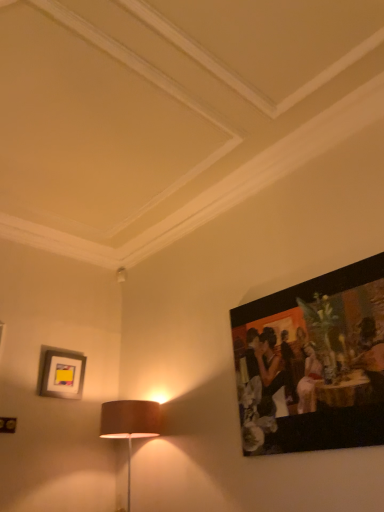
The height and width of the screenshot is (512, 384). What do you see at coordinates (61, 374) in the screenshot? I see `matte yellow picture frame at upper left, which is the first picture frame from back to front` at bounding box center [61, 374].

You are a GUI agent. You are given a task and a screenshot of the screen. Output one action in this format:
    pyautogui.click(x=<x>, y=<y>)
    Task: Click on the matte yellow picture frame at upper left, which is the first picture frame from back to front
    The width and height of the screenshot is (384, 512).
    Given the screenshot: What is the action you would take?
    pyautogui.click(x=61, y=374)

I want to click on matte black painting at upper right, which ranks as the 1th picture frame in front-to-back order, so click(x=313, y=362).

Describe the element at coordinates (313, 362) in the screenshot. Image resolution: width=384 pixels, height=512 pixels. I see `matte black painting at upper right, the second picture frame when ordered from left to right` at that location.

Looking at this image, how much space does matte black painting at upper right, the second picture frame when ordered from left to right, occupy vertically?

The height of matte black painting at upper right, the second picture frame when ordered from left to right, is 35.16 inches.

The image size is (384, 512). What are the coordinates of `matte yellow picture frame at upper left, marked as the 1th picture frame in a left-to-right arrangement` in the screenshot? It's located at (61, 374).

Is matte yellow picture frame at upper left, which is the first picture frame from back to front, at the left side of matte black painting at upper right, positioned as the 2th picture frame in back-to-front order?

Correct, you'll find matte yellow picture frame at upper left, which is the first picture frame from back to front, to the left of matte black painting at upper right, positioned as the 2th picture frame in back-to-front order.

Considering their positions, is matte yellow picture frame at upper left, which is the first picture frame from back to front, located in front of or behind matte black painting at upper right, which ranks as the 1th picture frame in front-to-back order?

In the image, matte yellow picture frame at upper left, which is the first picture frame from back to front, appears behind matte black painting at upper right, which ranks as the 1th picture frame in front-to-back order.

Is point (70, 362) farther from viewer compared to point (372, 329)?

Yes, it is behind point (372, 329).

From the image's perspective, is matte yellow picture frame at upper left, positioned as the 2th picture frame in right-to-left order, under matte black painting at upper right, the 1th picture frame positioned from the right?

Yes, from the image's perspective, matte yellow picture frame at upper left, positioned as the 2th picture frame in right-to-left order, is below matte black painting at upper right, the 1th picture frame positioned from the right.

From a real-world perspective, which is physically below, matte yellow picture frame at upper left, positioned as the 2th picture frame in right-to-left order, or matte black painting at upper right, which ranks as the 1th picture frame in front-to-back order?

matte black painting at upper right, which ranks as the 1th picture frame in front-to-back order, from a real-world perspective.

Consider the image. Which of these two, matte yellow picture frame at upper left, placed as the second picture frame when sorted from front to back, or matte black painting at upper right, positioned as the 2th picture frame in back-to-front order, is wider?

matte yellow picture frame at upper left, placed as the second picture frame when sorted from front to back.

Who is shorter, matte yellow picture frame at upper left, marked as the 1th picture frame in a left-to-right arrangement, or matte black painting at upper right, which ranks as the 1th picture frame in front-to-back order?

matte yellow picture frame at upper left, marked as the 1th picture frame in a left-to-right arrangement, is shorter.

Considering the sizes of matte yellow picture frame at upper left, which is the first picture frame from back to front, and matte black painting at upper right, the second picture frame when ordered from left to right, in the image, is matte yellow picture frame at upper left, which is the first picture frame from back to front, bigger or smaller than matte black painting at upper right, the second picture frame when ordered from left to right,?

Considering their sizes, matte yellow picture frame at upper left, which is the first picture frame from back to front, takes up less space than matte black painting at upper right, the second picture frame when ordered from left to right.

Does matte yellow picture frame at upper left, positioned as the 2th picture frame in right-to-left order, contain matte black painting at upper right, which ranks as the 1th picture frame in front-to-back order?

No.

Are matte yellow picture frame at upper left, positioned as the 2th picture frame in right-to-left order, and matte black painting at upper right, positioned as the 2th picture frame in back-to-front order, making contact?

No, matte yellow picture frame at upper left, positioned as the 2th picture frame in right-to-left order, is not in contact with matte black painting at upper right, positioned as the 2th picture frame in back-to-front order.

Is matte yellow picture frame at upper left, positioned as the 2th picture frame in right-to-left order, turned away from matte black painting at upper right, positioned as the 2th picture frame in back-to-front order?

No, matte black painting at upper right, positioned as the 2th picture frame in back-to-front order, is not at the back of matte yellow picture frame at upper left, positioned as the 2th picture frame in right-to-left order.

Can you tell me how much matte yellow picture frame at upper left, positioned as the 2th picture frame in right-to-left order, and matte black painting at upper right, the second picture frame when ordered from left to right, differ in facing direction?

The angular difference between matte yellow picture frame at upper left, positioned as the 2th picture frame in right-to-left order, and matte black painting at upper right, the second picture frame when ordered from left to right, is 93.5 degrees.

Where is `picture frame below the matte black painting at upper right, the 1th picture frame positioned from the right (from the image's perspective)`? The image size is (384, 512). picture frame below the matte black painting at upper right, the 1th picture frame positioned from the right (from the image's perspective) is located at coordinates (61, 374).

Does matte black painting at upper right, positioned as the 2th picture frame in back-to-front order, appear on the right side of matte yellow picture frame at upper left, marked as the 1th picture frame in a left-to-right arrangement?

Yes.

Consider the image. Considering their positions, is matte black painting at upper right, the second picture frame when ordered from left to right, located in front of or behind matte yellow picture frame at upper left, placed as the second picture frame when sorted from front to back?

matte black painting at upper right, the second picture frame when ordered from left to right, is positioned closer to the viewer than matte yellow picture frame at upper left, placed as the second picture frame when sorted from front to back.

Which is farther from the camera, (348,390) or (78,364)?

The point (78,364) is farther.

Based on the photo, from the image's perspective, who appears lower, matte black painting at upper right, positioned as the 2th picture frame in back-to-front order, or matte yellow picture frame at upper left, which is the first picture frame from back to front?

From the image's view, matte yellow picture frame at upper left, which is the first picture frame from back to front, is below.

From a real-world perspective, who is located higher, matte black painting at upper right, the 1th picture frame positioned from the right, or matte yellow picture frame at upper left, placed as the second picture frame when sorted from front to back?

matte yellow picture frame at upper left, placed as the second picture frame when sorted from front to back, from a real-world perspective.

Between matte black painting at upper right, positioned as the 2th picture frame in back-to-front order, and matte yellow picture frame at upper left, marked as the 1th picture frame in a left-to-right arrangement, which one has smaller width?

With smaller width is matte black painting at upper right, positioned as the 2th picture frame in back-to-front order.

Is matte black painting at upper right, the 1th picture frame positioned from the right, taller or shorter than matte yellow picture frame at upper left, positioned as the 2th picture frame in right-to-left order?

Considering their sizes, matte black painting at upper right, the 1th picture frame positioned from the right, has more height than matte yellow picture frame at upper left, positioned as the 2th picture frame in right-to-left order.

Based on their sizes in the image, would you say matte black painting at upper right, the second picture frame when ordered from left to right, is bigger or smaller than matte yellow picture frame at upper left, positioned as the 2th picture frame in right-to-left order?

Considering their sizes, matte black painting at upper right, the second picture frame when ordered from left to right, takes up more space than matte yellow picture frame at upper left, positioned as the 2th picture frame in right-to-left order.

From the picture: Is matte black painting at upper right, positioned as the 2th picture frame in back-to-front order, outside of matte yellow picture frame at upper left, marked as the 1th picture frame in a left-to-right arrangement?

Indeed, matte black painting at upper right, positioned as the 2th picture frame in back-to-front order, is completely outside matte yellow picture frame at upper left, marked as the 1th picture frame in a left-to-right arrangement.

Is matte black painting at upper right, positioned as the 2th picture frame in back-to-front order, not close to matte yellow picture frame at upper left, positioned as the 2th picture frame in right-to-left order?

Yes, matte black painting at upper right, positioned as the 2th picture frame in back-to-front order, and matte yellow picture frame at upper left, positioned as the 2th picture frame in right-to-left order, are quite far apart.

Is matte black painting at upper right, the second picture frame when ordered from left to right, looking in the opposite direction of matte yellow picture frame at upper left, positioned as the 2th picture frame in right-to-left order?

No, matte black painting at upper right, the second picture frame when ordered from left to right, is not facing the opposite direction of matte yellow picture frame at upper left, positioned as the 2th picture frame in right-to-left order.

How much distance is there between matte black painting at upper right, the second picture frame when ordered from left to right, and matte yellow picture frame at upper left, placed as the second picture frame when sorted from front to back?

They are 5.75 feet apart.

The height and width of the screenshot is (512, 384). What are the coordinates of `picture frame directly beneath the matte yellow picture frame at upper left, placed as the second picture frame when sorted from front to back (from a real-world perspective)` in the screenshot? It's located at (313, 362).

The image size is (384, 512). What are the coordinates of `picture frame on the right of matte yellow picture frame at upper left, placed as the second picture frame when sorted from front to back` in the screenshot? It's located at (313, 362).

Identify the location of picture frame above the matte black painting at upper right, positioned as the 2th picture frame in back-to-front order (from a real-world perspective). (61, 374).